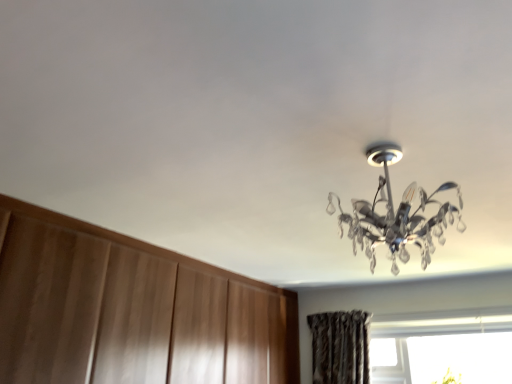
This screenshot has height=384, width=512. What are the coordinates of `clear crystal chandelier at upper center` in the screenshot? It's located at pyautogui.click(x=396, y=215).

What do you see at coordinates (396, 215) in the screenshot?
I see `clear crystal chandelier at upper center` at bounding box center [396, 215].

The image size is (512, 384). What are the coordinates of `clear crystal chandelier at upper center` in the screenshot? It's located at (396, 215).